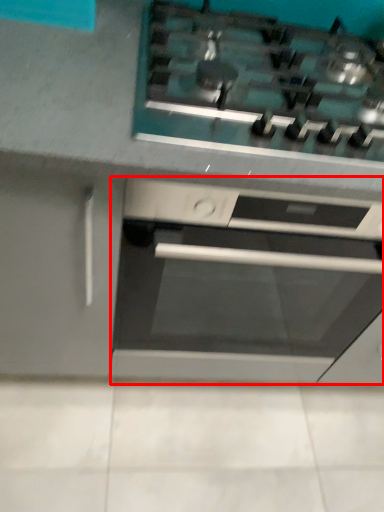
Question: Where is home appliance (annotated by the red box) located in relation to gas stove in the image?

Choices:
 (A) left
 (B) right

Answer: (A)